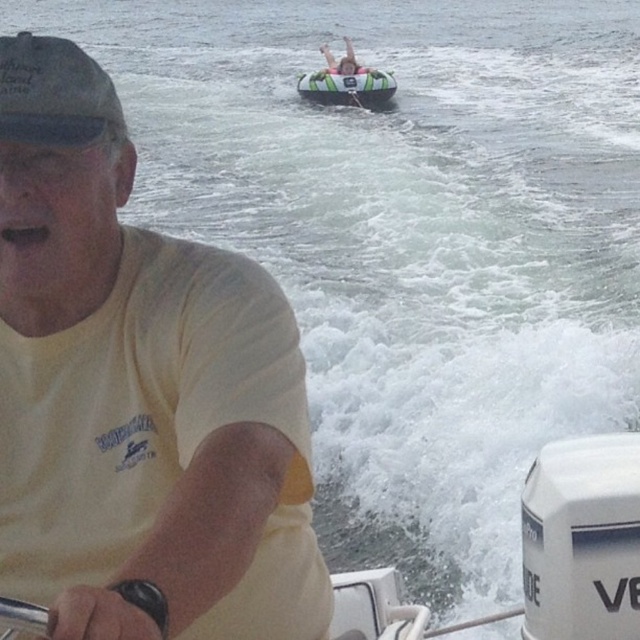
You are a photographer on a boat and need to position your camera to capture the dark gray matte baseball cap at upper left. What are the coordinates of the cap?

The coordinates of the dark gray matte baseball cap at upper left are at point (x=54, y=93).

From the picture: You are a photographer trying to capture a clear shot of the dark gray matte baseball cap at upper left and the smooth skin human at upper center in the image. Which object would appear narrower in your photo?

The dark gray matte baseball cap at upper left is thinner than the smooth skin human at upper center, so it would appear narrower in the photo.